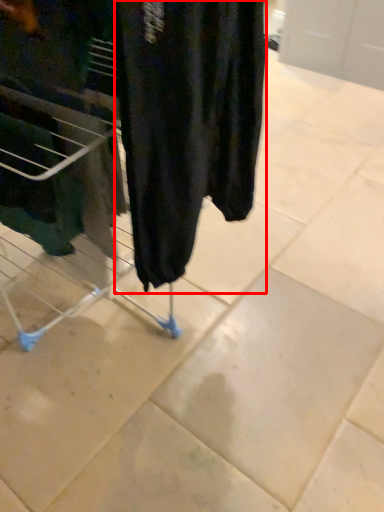
Question: Considering the relative positions of clothing (annotated by the red box) and furniture in the image provided, where is clothing (annotated by the red box) located with respect to the staircase?

Choices:
 (A) left
 (B) right

Answer: (B)